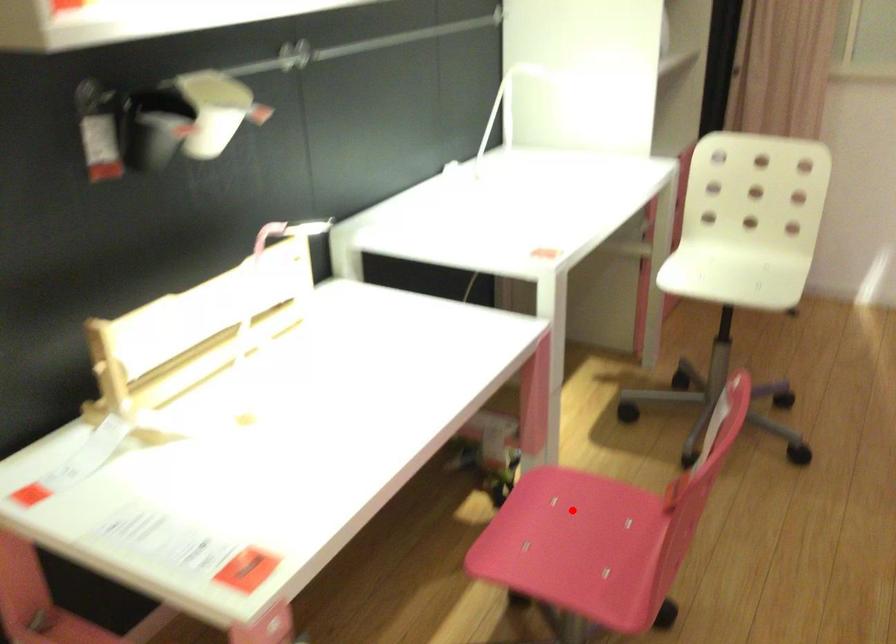
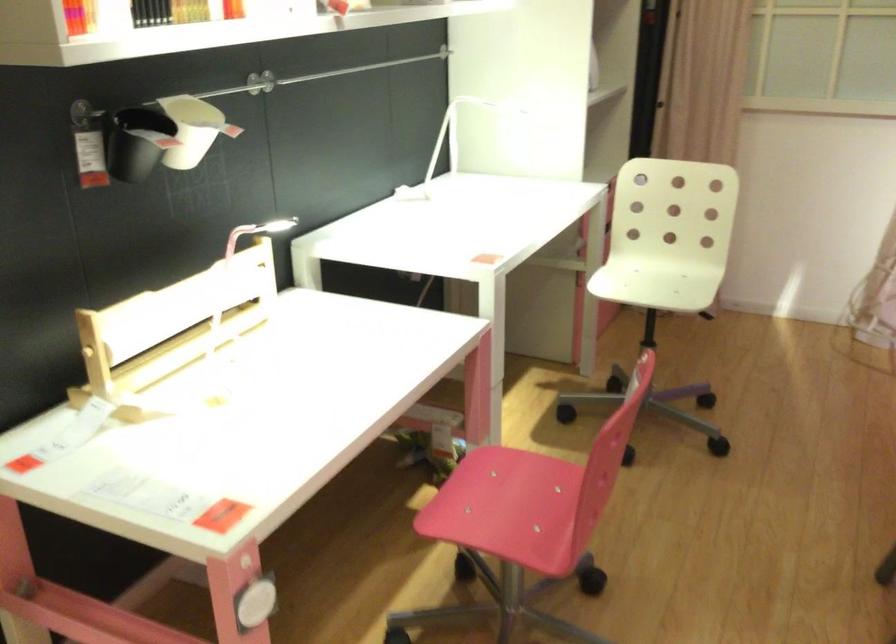
The point at the highlighted location is marked in the first image. Where is the corresponding point in the second image?

(511, 482)